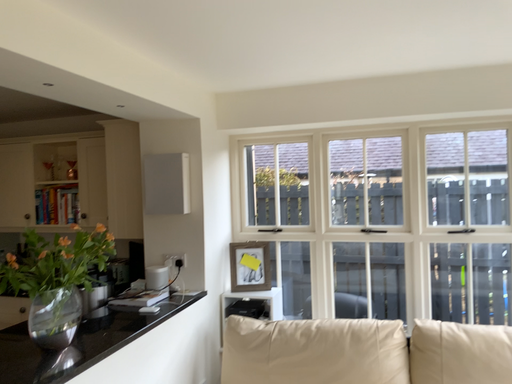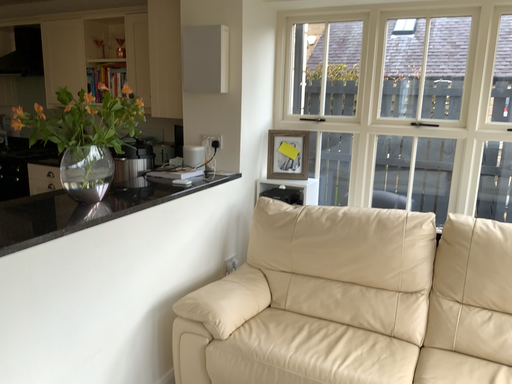
Question: How did the camera likely rotate when shooting the video?

Choices:
 (A) rotated upward
 (B) rotated downward

Answer: (B)